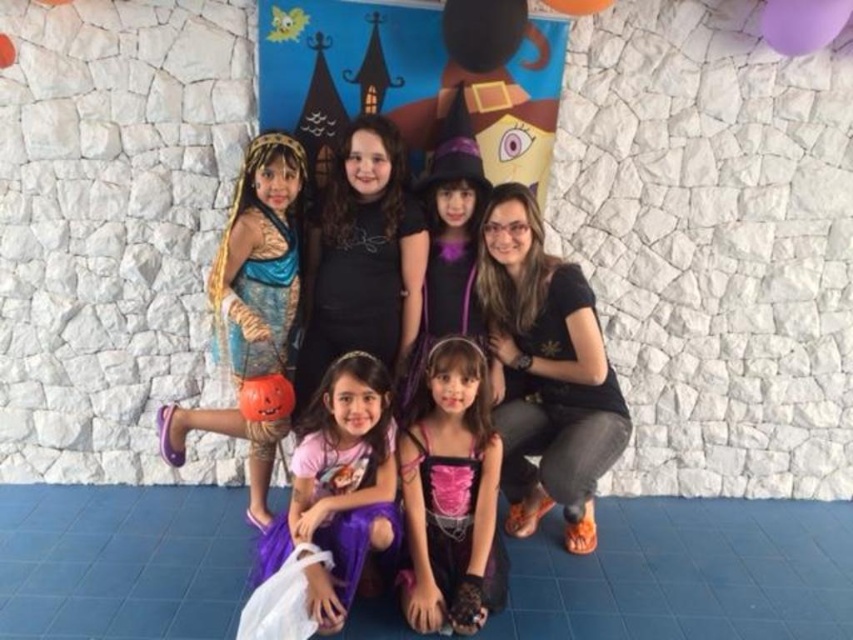
Question: Observing the image, what is the correct spatial positioning of matte purple dress at center in reference to pink satin dress at lower center?

Choices:
 (A) above
 (B) below

Answer: (A)

Question: Does matte purple dress at center have a larger size compared to pink satin dress at lower center?

Choices:
 (A) no
 (B) yes

Answer: (B)

Question: Which point is closer to the camera?

Choices:
 (A) (210, 292)
 (B) (370, 252)
 (C) (221, 248)

Answer: (C)

Question: Which point is closer to the camera?

Choices:
 (A) (231, 365)
 (B) (331, 333)
 (C) (492, 214)

Answer: (C)

Question: Can you confirm if black matte shirt at center is positioned below pink satin dress at lower center?

Choices:
 (A) no
 (B) yes

Answer: (A)

Question: Which object appears farthest from the camera in this image?

Choices:
 (A) black matte dress at center
 (B) black matte shirt at center
 (C) pink satin dress at lower center
 (D) shiny gold costume at left

Answer: (A)